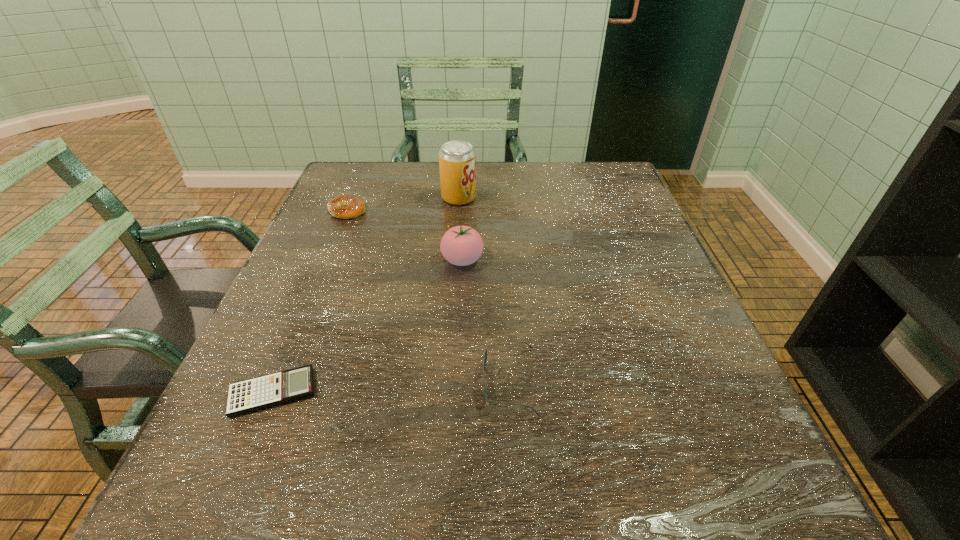
The width and height of the screenshot is (960, 540). Find the location of `object identified as the third closest to the third shortest object`. object identified as the third closest to the third shortest object is located at coordinates (457, 159).

The image size is (960, 540). I want to click on blank space that satisfies the following two spatial constraints: 1. on the front side of the shortest object; 2. on the left side of the bagel, so click(271, 393).